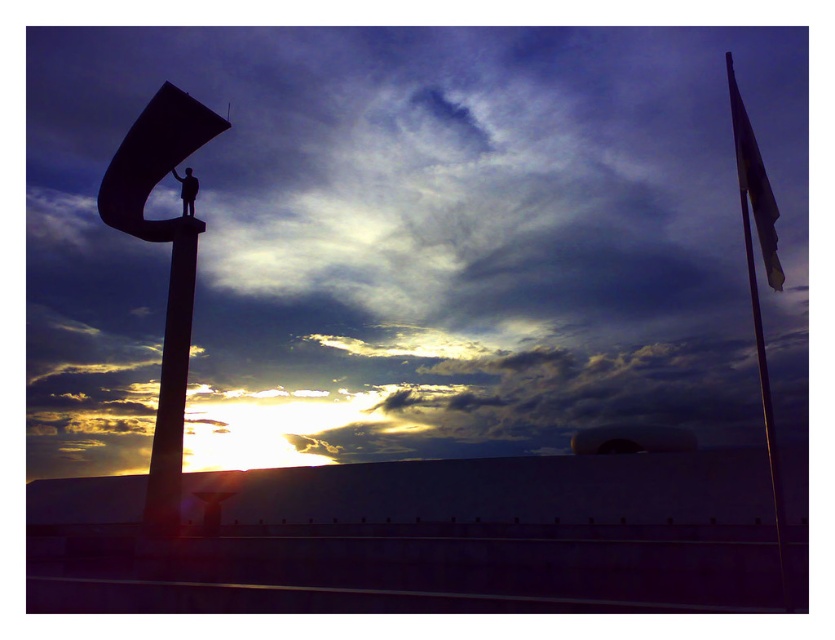
Question: Which point is farther to the camera?

Choices:
 (A) smooth concrete pole at center
 (B) silhouette metal sculpture at left
 (C) yellow fabric flag at upper right
 (D) cloudy sky at upper center

Answer: (D)

Question: Can you confirm if silhouette metal sculpture at left is thinner than silhouette figure at center?

Choices:
 (A) yes
 (B) no

Answer: (B)

Question: Is smooth concrete pole at center smaller than silhouette figure at center?

Choices:
 (A) no
 (B) yes

Answer: (A)

Question: Which object is farther from the camera taking this photo?

Choices:
 (A) cloudy sky at upper center
 (B) silhouette metal sculpture at left
 (C) smooth concrete pole at center
 (D) silhouette figure at center

Answer: (D)

Question: Does cloudy sky at upper center appear on the left side of silhouette concrete sculpture at center?

Choices:
 (A) yes
 (B) no

Answer: (B)

Question: Which of the following is the closest to the observer?

Choices:
 (A) (139, 202)
 (B) (742, 145)
 (C) (142, 122)

Answer: (B)